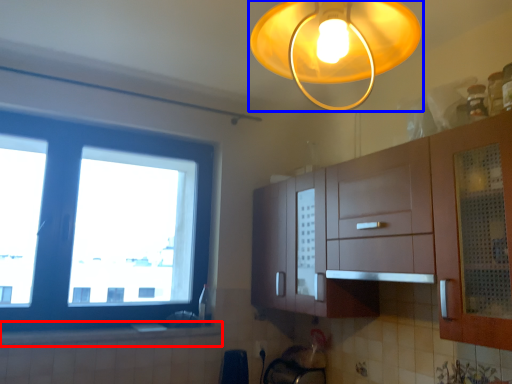
Question: Which object is closer to the camera taking this photo, counter top (highlighted by a red box) or lamp (highlighted by a blue box)?

Choices:
 (A) counter top
 (B) lamp

Answer: (B)